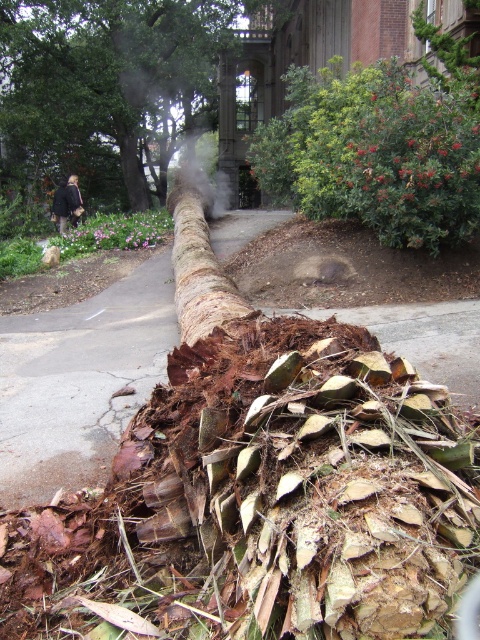
Question: Can you confirm if gray concrete pavement at center is positioned to the left of brown rough bark at center?

Choices:
 (A) no
 (B) yes

Answer: (A)

Question: Is white smoke at center below black coat at lower left?

Choices:
 (A) no
 (B) yes

Answer: (A)

Question: Which point appears farthest from the camera in this image?

Choices:
 (A) (295, 308)
 (B) (67, 184)

Answer: (B)

Question: Is white smoke at center above dark brown leather jacket at upper left?

Choices:
 (A) yes
 (B) no

Answer: (A)

Question: Which object is the farthest from the gray concrete pavement at center?

Choices:
 (A) brown rough bark at center
 (B) black coat at lower left

Answer: (A)

Question: Which of the following is the farthest from the observer?

Choices:
 (A) (67, 192)
 (B) (195, 237)

Answer: (A)